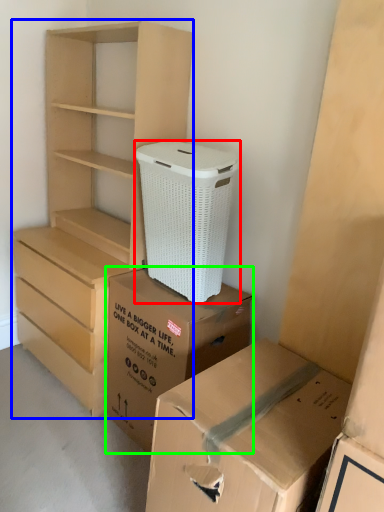
Question: Considering the real-world distances, which object is closest to shoe box (highlighted by a red box)? chest of drawers (highlighted by a blue box) or box (highlighted by a green box).

Choices:
 (A) chest of drawers
 (B) box

Answer: (B)